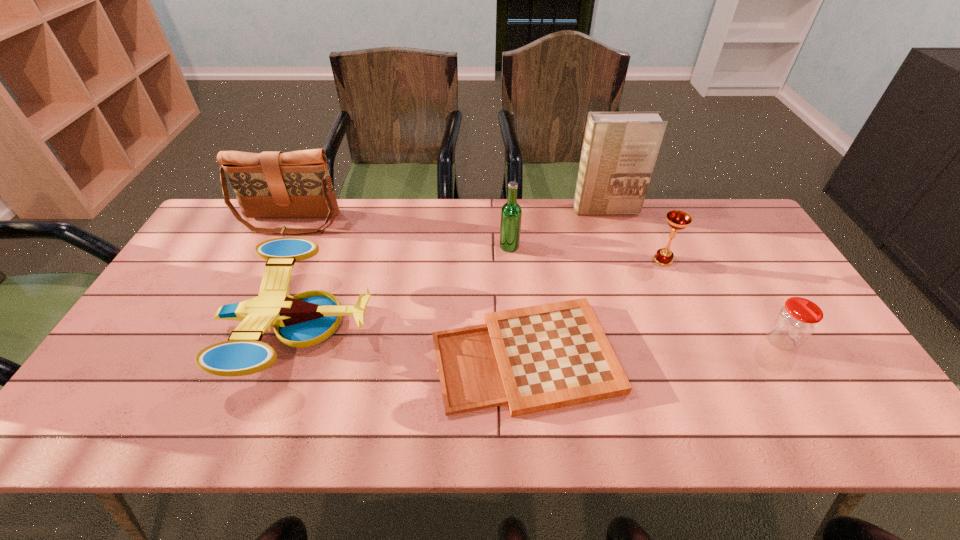
You are a GUI agent. You are given a task and a screenshot of the screen. Output one action in this format:
    pyautogui.click(x=<x>, y=<y>)
    Task: Click on the vacant space that satisfies the following two spatial constraints: 1. on the cover of the tallest object; 2. at the cockpit of the drone
    The width and height of the screenshot is (960, 540).
    Given the screenshot: What is the action you would take?
    pyautogui.click(x=644, y=327)

Where is `vacant area that satisfies the following two spatial constraints: 1. on the front-facing side of the beer bottle; 2. on the left side of the shoulder bag`? The height and width of the screenshot is (540, 960). vacant area that satisfies the following two spatial constraints: 1. on the front-facing side of the beer bottle; 2. on the left side of the shoulder bag is located at coordinates (x=279, y=246).

Locate an element on the screen. Image resolution: width=960 pixels, height=540 pixels. vacant space that satisfies the following two spatial constraints: 1. at the cockpit of the rightmost object; 2. on the right side of the drone is located at coordinates (293, 341).